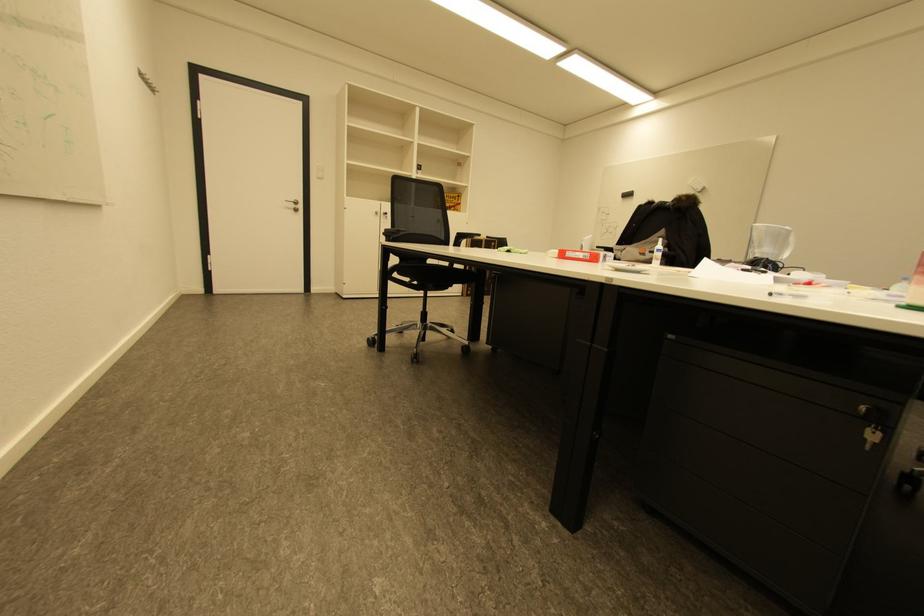
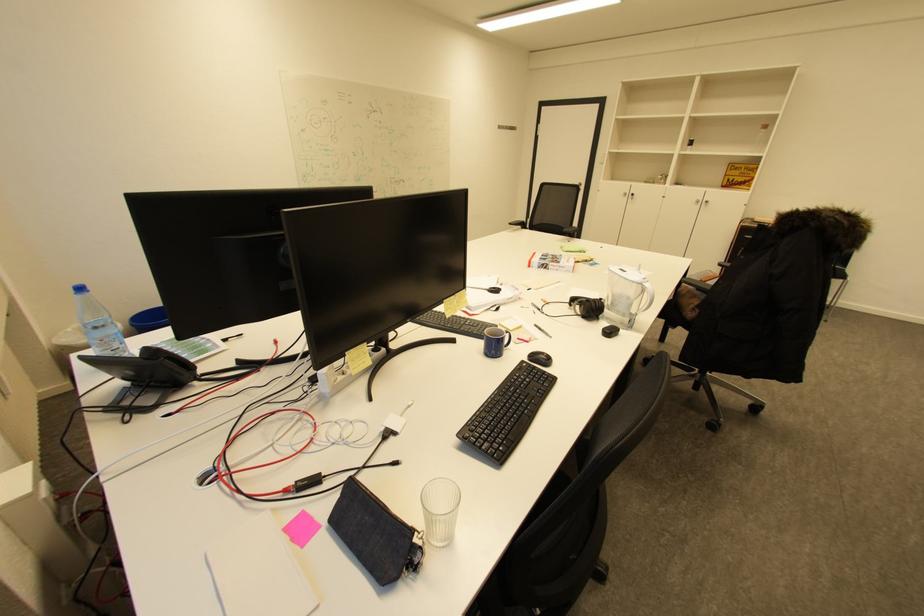
Locate, in the second image, the point that corresponds to the point at 382,214 in the first image.

(630, 195)